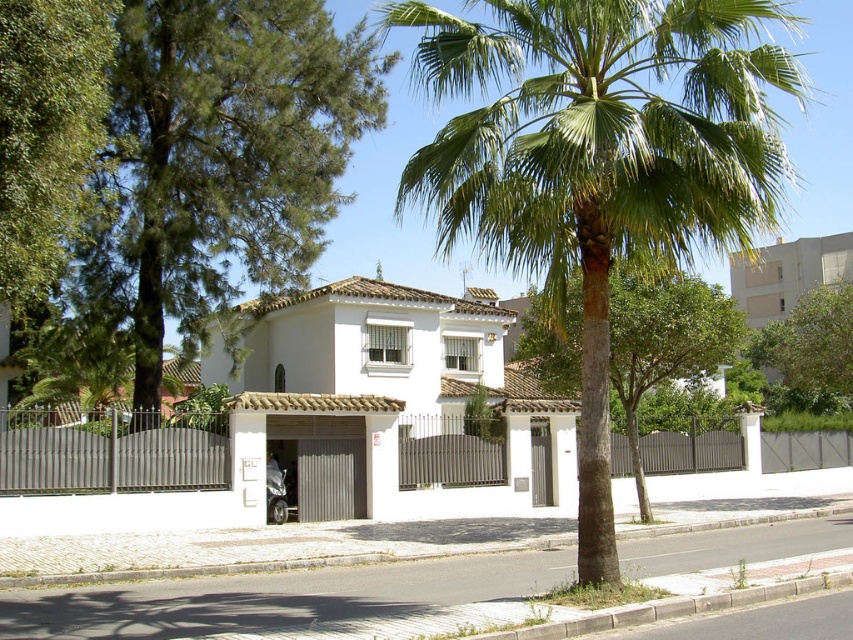
You are a landscape architect designing a garden. You need to place a tall statue between the green leafy palm tree at center and the green leafy tree at center. Which tree should the statue be placed closer to based on their heights?

The green leafy palm tree at center is taller than the green leafy tree at center, so the statue should be placed closer to the green leafy palm tree at center to maintain visual balance.

You are standing in front of the house and want to take a photo of the green leafy palm tree at center. Where should you position yourself to capture it in the center of your camera frame?

To capture the green leafy palm tree at center in the center of your camera frame, position yourself directly in front of the house at the point corresponding to its 2D location at coordinates [601,160].

You are standing at the entrance of the house and want to walk towards the point labeled as point (721, 300). However, there is an obstacle at point (700, 236). Will you encounter this obstacle before reaching your destination?

Yes, you will encounter the obstacle at point (700, 236) before reaching point (721, 300) because point (700, 236) is in front of point (721, 300).